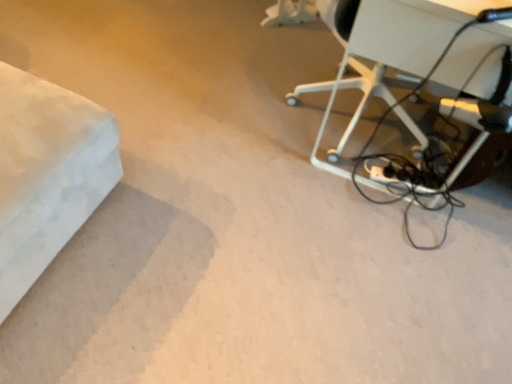
What is the approximate width of black matte extension cord at lower right?

It is 6.97 centimeters.

What do you see at coordinates (399, 181) in the screenshot? I see `black matte extension cord at lower right` at bounding box center [399, 181].

Where is `black matte extension cord at lower right`? The height and width of the screenshot is (384, 512). black matte extension cord at lower right is located at coordinates (399, 181).

Describe the element at coordinates (412, 29) in the screenshot. I see `white plastic table at upper right` at that location.

This screenshot has height=384, width=512. I want to click on white plastic table at upper right, so click(412, 29).

Looking at this image, measure the distance between point (x=369, y=36) and camera.

Point (x=369, y=36) and camera are 4.08 feet apart.

What are the coordinates of `black matte extension cord at lower right` in the screenshot? It's located at (399, 181).

Considering the relative positions of black matte extension cord at lower right and white plastic table at upper right in the image provided, is black matte extension cord at lower right to the left or to the right of white plastic table at upper right?

In the image, black matte extension cord at lower right appears on the left side of white plastic table at upper right.

Does black matte extension cord at lower right lie behind white plastic table at upper right?

Yes.

Does point (378, 166) appear closer or farther from the camera than point (450, 28)?

Point (378, 166) is farther from the camera than point (450, 28).

From the image's perspective, is black matte extension cord at lower right on top of white plastic table at upper right?

No, from the image's perspective, black matte extension cord at lower right is not above white plastic table at upper right.

From a real-world perspective, is black matte extension cord at lower right below white plastic table at upper right?

Correct, in the physical world, black matte extension cord at lower right is lower than white plastic table at upper right.

In the scene shown: Is black matte extension cord at lower right wider or thinner than white plastic table at upper right?

Clearly, black matte extension cord at lower right has less width compared to white plastic table at upper right.

Between black matte extension cord at lower right and white plastic table at upper right, which one has less height?

With less height is black matte extension cord at lower right.

Is black matte extension cord at lower right bigger than white plastic table at upper right?

Incorrect, black matte extension cord at lower right is not larger than white plastic table at upper right.

Would you say black matte extension cord at lower right contains white plastic table at upper right?

That's incorrect, white plastic table at upper right is not inside black matte extension cord at lower right.

Are black matte extension cord at lower right and white plastic table at upper right located far from each other?

They are positioned close to each other.

From the picture: Is black matte extension cord at lower right positioned with its back to white plastic table at upper right?

Yes, black matte extension cord at lower right's orientation is away from white plastic table at upper right.

Measure the distance from black matte extension cord at lower right to white plastic table at upper right.

black matte extension cord at lower right and white plastic table at upper right are 20.84 inches apart.

Locate an element on the screen. extension cord behind the white plastic table at upper right is located at coordinates [x=399, y=181].

Is white plastic table at upper right at the left side of black matte extension cord at lower right?

In fact, white plastic table at upper right is to the right of black matte extension cord at lower right.

Which is in front, white plastic table at upper right or black matte extension cord at lower right?

white plastic table at upper right is closer to the camera.

Does point (465, 45) appear closer or farther from the camera than point (400, 182)?

Point (465, 45) is closer to the camera than point (400, 182).

From the image's perspective, relative to black matte extension cord at lower right, is white plastic table at upper right above or below?

white plastic table at upper right is above black matte extension cord at lower right.

From a real-world perspective, which object rests below the other?

black matte extension cord at lower right is physically lower.

Is white plastic table at upper right wider than black matte extension cord at lower right?

Correct, the width of white plastic table at upper right exceeds that of black matte extension cord at lower right.

Can you confirm if white plastic table at upper right is shorter than black matte extension cord at lower right?

No, white plastic table at upper right is not shorter than black matte extension cord at lower right.

Who is bigger, white plastic table at upper right or black matte extension cord at lower right?

With larger size is white plastic table at upper right.

Is white plastic table at upper right surrounding black matte extension cord at lower right?

Indeed, black matte extension cord at lower right is located within white plastic table at upper right.

Does white plastic table at upper right touch black matte extension cord at lower right?

No, white plastic table at upper right is not making contact with black matte extension cord at lower right.

Is black matte extension cord at lower right at the back of white plastic table at upper right?

No, black matte extension cord at lower right is not at the back of white plastic table at upper right.

What's the angular difference between white plastic table at upper right and black matte extension cord at lower right's facing directions?

They differ by 94.2 degrees in their facing directions.

In order to click on extension cord behind the white plastic table at upper right in this screenshot , I will do `click(399, 181)`.

The image size is (512, 384). I want to click on extension cord below the white plastic table at upper right (from the image's perspective), so click(x=399, y=181).

Locate an element on the screen. extension cord below the white plastic table at upper right (from a real-world perspective) is located at coordinates (x=399, y=181).